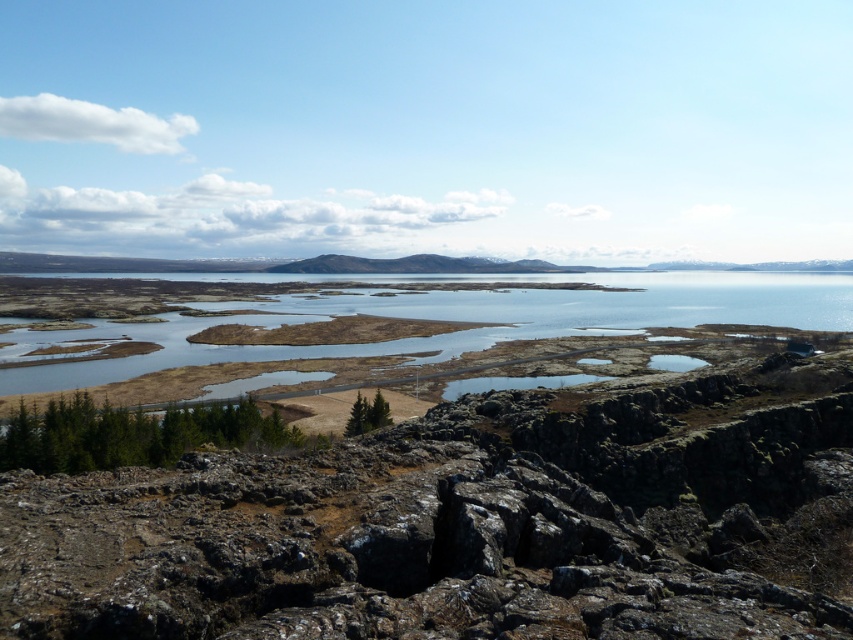
You are a GUI agent. You are given a task and a screenshot of the screen. Output one action in this format:
    pyautogui.click(x=<x>, y=<y>)
    Task: Click on the rusty rock at center
    The height and width of the screenshot is (640, 853).
    Given the screenshot: What is the action you would take?
    click(473, 522)

Does rusty rock at center have a greater height compared to clear water at center?

In fact, rusty rock at center may be shorter than clear water at center.

Which is behind, point (0, 620) or point (521, 333)?

The point (521, 333) is behind.

At what (x,y) coordinates should I click in order to perform the action: click on rusty rock at center. Please return your answer as a coordinate pair (x, y). Image resolution: width=853 pixels, height=640 pixels. Looking at the image, I should click on (473, 522).